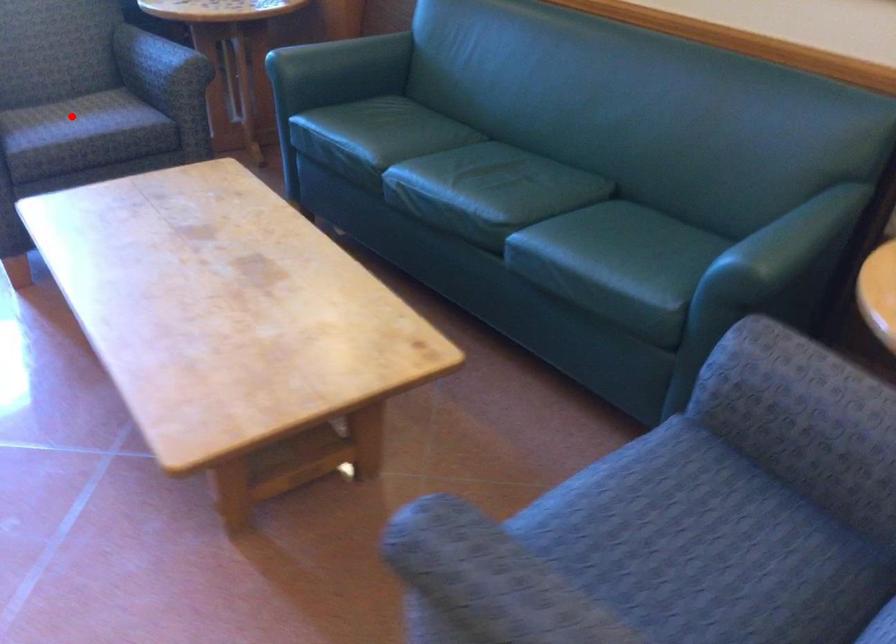
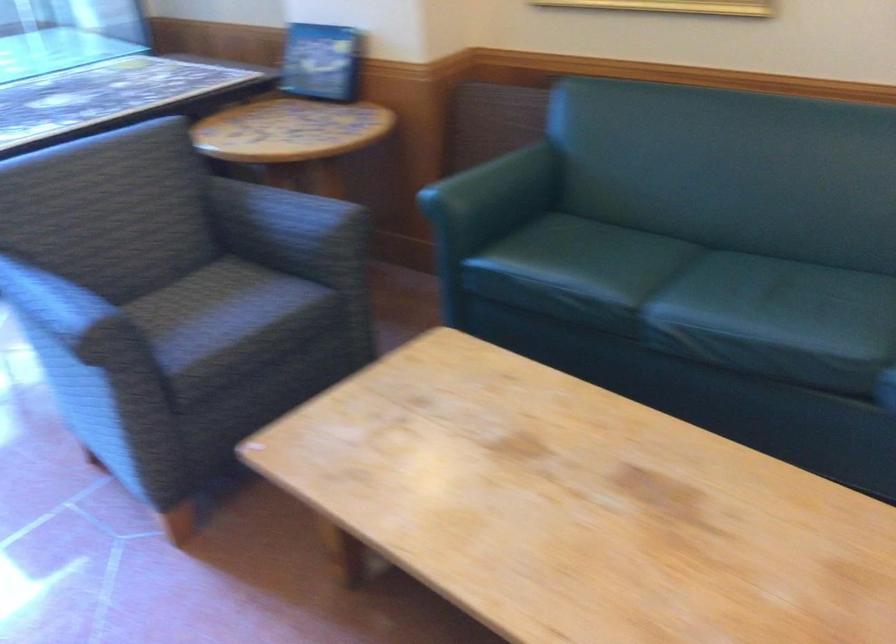
Question: I am providing you with two images of the same scene from different viewpoints. Image1 has a red point marked. In image2, the corresponding 3D location appears at what relative position? Reply with the corresponding letter.

Choices:
 (A) Closer
 (B) Farther

Answer: (A)